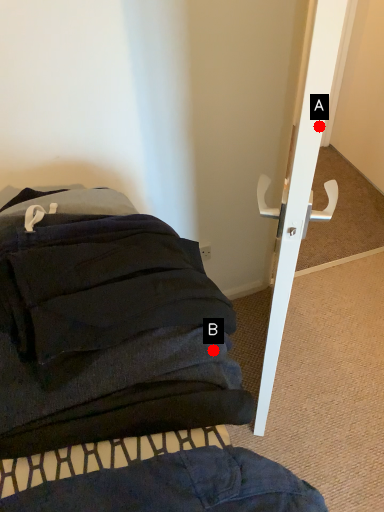
Question: Two points are circled on the image, labeled by A and B beside each circle. Which point is closer to the camera taking this photo?

Choices:
 (A) A is closer
 (B) B is closer

Answer: (A)